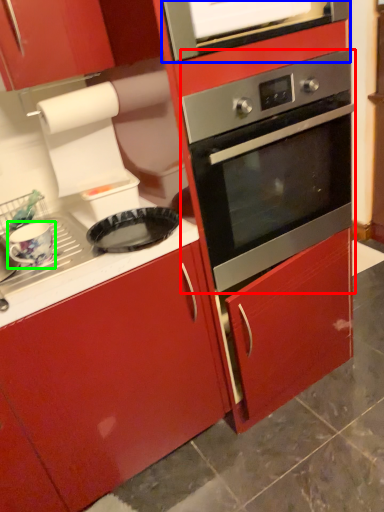
Question: Estimate the real-world distances between objects in this image. Which object is closer to oven (highlighted by a red box), vent (highlighted by a blue box) or appliance (highlighted by a green box)?

Choices:
 (A) vent
 (B) appliance

Answer: (A)